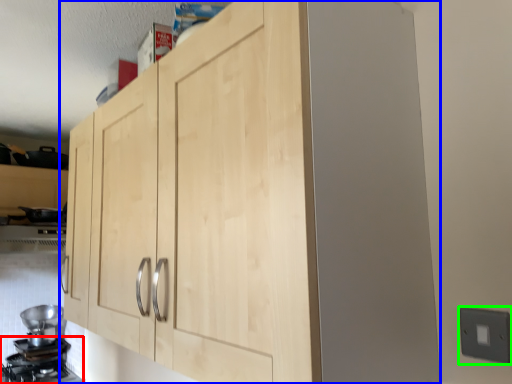
Question: Estimate the real-world distances between objects in this image. Which object is closer to gas stove (highlighted by a red box), cupboard (highlighted by a blue box) or electric outlet (highlighted by a green box)?

Choices:
 (A) cupboard
 (B) electric outlet

Answer: (A)